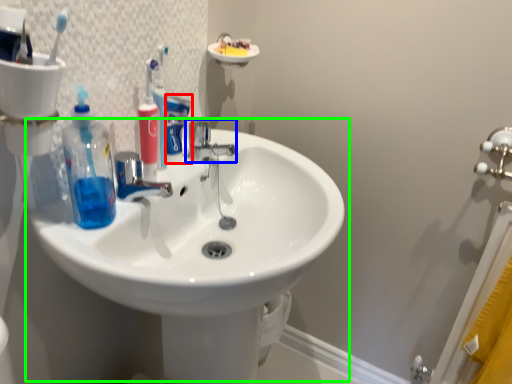
Question: Which is farther away from toothpaste (highlighted by a red box)? tap (highlighted by a blue box) or sink (highlighted by a green box)?

Choices:
 (A) tap
 (B) sink

Answer: (B)